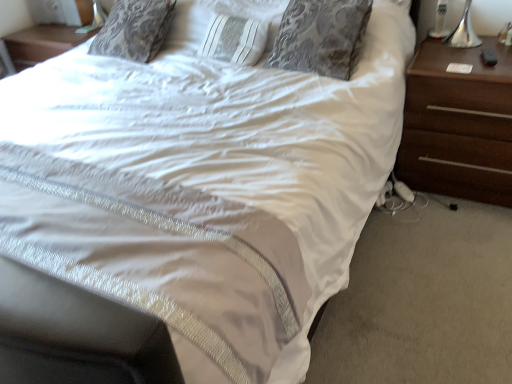
Question: Looking at the image, does silver damask pillow at upper center seem bigger or smaller compared to brown wood nightstand at right?

Choices:
 (A) small
 (B) big

Answer: (A)

Question: From their relative heights in the image, would you say silver damask pillow at upper center is taller or shorter than brown wood nightstand at right?

Choices:
 (A) short
 (B) tall

Answer: (A)

Question: Do you think silver damask pillow at upper center is within brown wood nightstand at right, or outside of it?

Choices:
 (A) outside
 (B) inside

Answer: (A)

Question: Considering the positions of brown wood nightstand at right and silver damask pillow at upper center in the image, is brown wood nightstand at right wider or thinner than silver damask pillow at upper center?

Choices:
 (A) thin
 (B) wide

Answer: (B)

Question: Does point (424, 165) appear closer or farther from the camera than point (292, 46)?

Choices:
 (A) closer
 (B) farther

Answer: (B)

Question: Is brown wood nightstand at right situated inside silver damask pillow at upper center or outside?

Choices:
 (A) outside
 (B) inside

Answer: (A)

Question: From a real-world perspective, is brown wood nightstand at right positioned above or below silver damask pillow at upper center?

Choices:
 (A) above
 (B) below

Answer: (B)